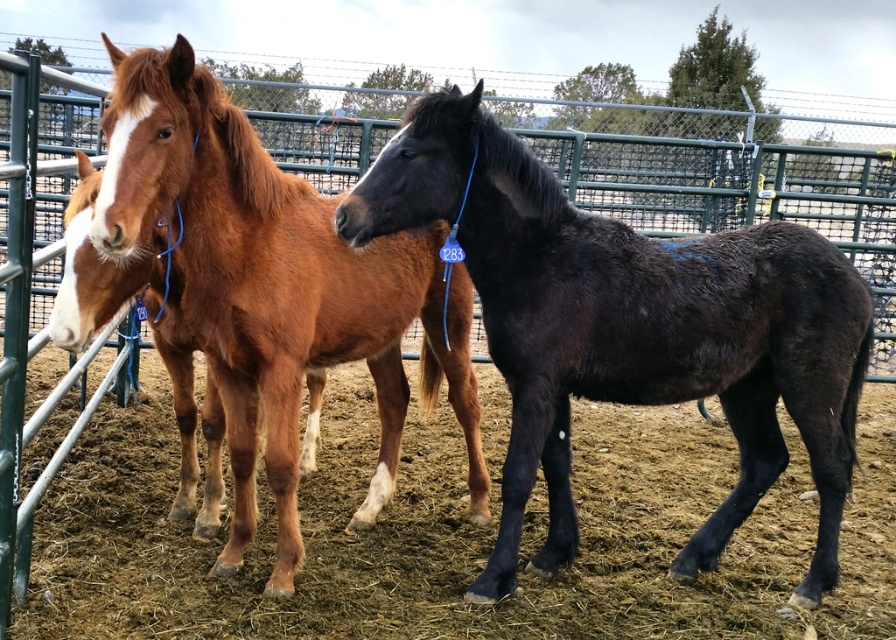
Question: Observing the image, what is the correct spatial positioning of brown hay at lower center in reference to green metal fence at center?

Choices:
 (A) below
 (B) above

Answer: (A)

Question: Which of the following is the closest to the observer?

Choices:
 (A) brown hay at lower center
 (B) black glossy horse at center
 (C) brown glossy horse at center

Answer: (C)

Question: Based on their relative distances, which object is farther from the black glossy horse at center?

Choices:
 (A) green metal fence at center
 (B) brown glossy horse at center
 (C) brown hay at lower center

Answer: (A)

Question: Is the position of brown glossy horse at center less distant than that of green metal fence at center?

Choices:
 (A) no
 (B) yes

Answer: (B)

Question: Is brown hay at lower center bigger than green metal fence at center?

Choices:
 (A) no
 (B) yes

Answer: (B)

Question: Which object is positioned farthest from the green metal fence at center?

Choices:
 (A) brown hay at lower center
 (B) brown glossy horse at center
 (C) black glossy horse at center

Answer: (B)